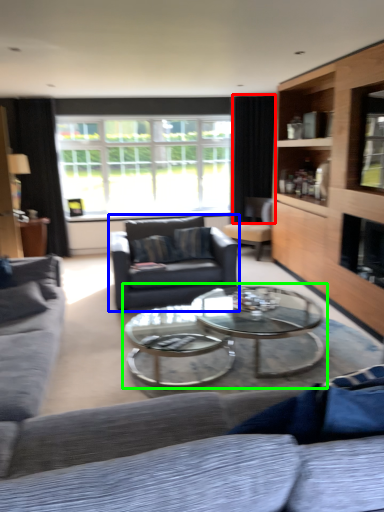
Question: Based on their relative distances, which object is nearer to curtain (highlighted by a red box)? Choose from swivel chair (highlighted by a blue box) and coffee table (highlighted by a green box).

Choices:
 (A) swivel chair
 (B) coffee table

Answer: (A)